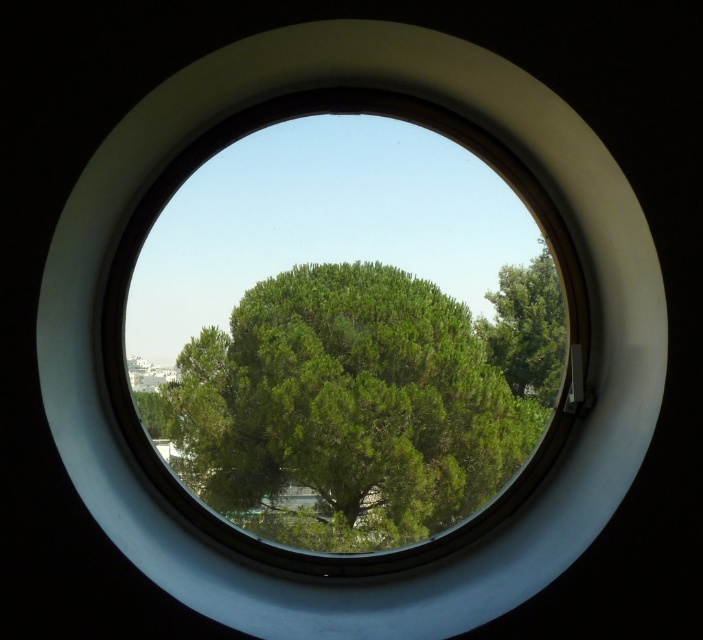
Question: Which of the following is the closest to the observer?

Choices:
 (A) (520, 288)
 (B) (361, 531)

Answer: (B)

Question: Is green leafy tree at center wider than green leafy tree at right?

Choices:
 (A) yes
 (B) no

Answer: (A)

Question: Which object is farther from the camera taking this photo?

Choices:
 (A) green leafy tree at right
 (B) green leafy tree at center

Answer: (B)

Question: Which object appears closest to the camera in this image?

Choices:
 (A) green leafy tree at center
 (B) green leafy tree at right

Answer: (B)

Question: Is green leafy tree at center wider than green leafy tree at right?

Choices:
 (A) no
 (B) yes

Answer: (B)

Question: Considering the relative positions of green leafy tree at center and green leafy tree at right in the image provided, where is green leafy tree at center located with respect to green leafy tree at right?

Choices:
 (A) right
 (B) left

Answer: (B)